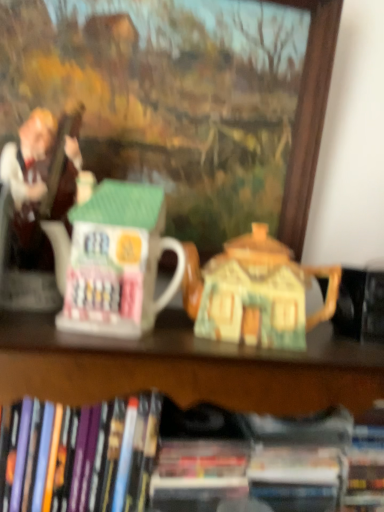
Question: Is matte ceramic house at center surrounded by hardcover book at lower center, the first book when ordered from right to left?

Choices:
 (A) yes
 (B) no

Answer: (B)

Question: Does hardcover book at lower center, the first book when ordered from right to left, have a smaller size compared to matte ceramic house at center?

Choices:
 (A) no
 (B) yes

Answer: (A)

Question: Is hardcover book at lower center, the first book when ordered from right to left, behind matte ceramic house at center?

Choices:
 (A) no
 (B) yes

Answer: (A)

Question: From a real-world perspective, does hardcover book at lower center, which is counted as the second book, starting from the left, sit lower than matte ceramic house at center?

Choices:
 (A) yes
 (B) no

Answer: (A)

Question: From a real-world perspective, is hardcover book at lower center, the first book when ordered from right to left, physically above matte ceramic house at center?

Choices:
 (A) no
 (B) yes

Answer: (A)

Question: From a real-world perspective, relative to matte ceramic house at center, is hardcover book at lower center, which is counted as the second book, starting from the left, vertically above or below?

Choices:
 (A) above
 (B) below

Answer: (B)

Question: Considering their positions, is hardcover book at lower center, which is counted as the second book, starting from the left, located in front of or behind matte ceramic house at center?

Choices:
 (A) front
 (B) behind

Answer: (A)

Question: From their relative heights in the image, would you say hardcover book at lower center, which is counted as the second book, starting from the left, is taller or shorter than matte ceramic house at center?

Choices:
 (A) short
 (B) tall

Answer: (A)

Question: Is point (226, 434) closer or farther from the camera than point (301, 124)?

Choices:
 (A) farther
 (B) closer

Answer: (B)

Question: In the image, is hardcover book at lower center, the first book when ordered from right to left, positioned in front of or behind matte brown statue at left?

Choices:
 (A) front
 (B) behind

Answer: (B)

Question: From a real-world perspective, is hardcover book at lower center, which is counted as the second book, starting from the left, physically located above or below matte brown statue at left?

Choices:
 (A) above
 (B) below

Answer: (B)

Question: In terms of width, does hardcover book at lower center, which is counted as the second book, starting from the left, look wider or thinner when compared to matte brown statue at left?

Choices:
 (A) thin
 (B) wide

Answer: (B)

Question: Considering the positions of hardcover book at lower center, the first book when ordered from right to left, and matte brown statue at left in the image, is hardcover book at lower center, the first book when ordered from right to left, bigger or smaller than matte brown statue at left?

Choices:
 (A) big
 (B) small

Answer: (A)

Question: From a real-world perspective, is white glossy house-shaped mug at center positioned above or below hardcover book at lower center, the first book when ordered from right to left?

Choices:
 (A) below
 (B) above

Answer: (B)

Question: Is white glossy house-shaped mug at center wider or thinner than hardcover book at lower center, which is counted as the second book, starting from the left?

Choices:
 (A) thin
 (B) wide

Answer: (A)